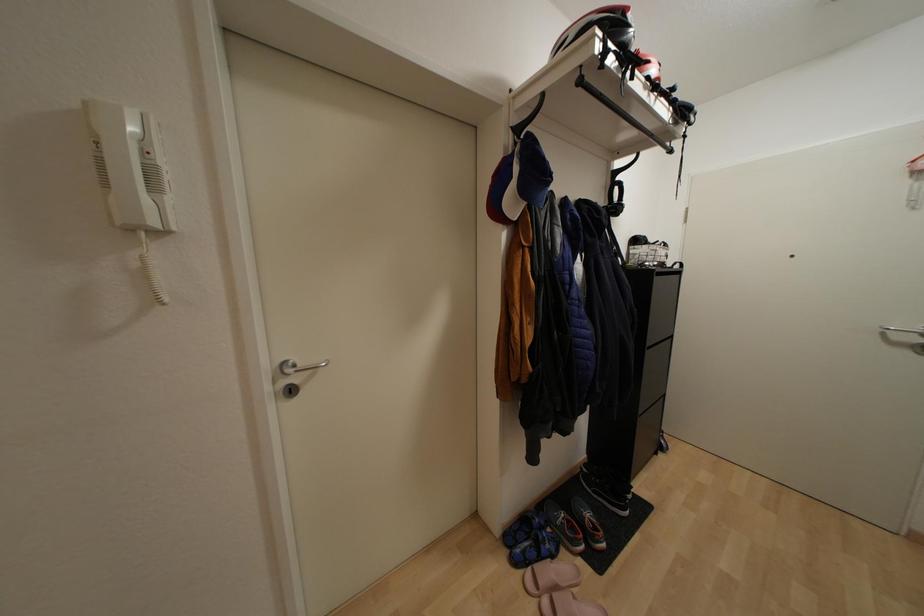
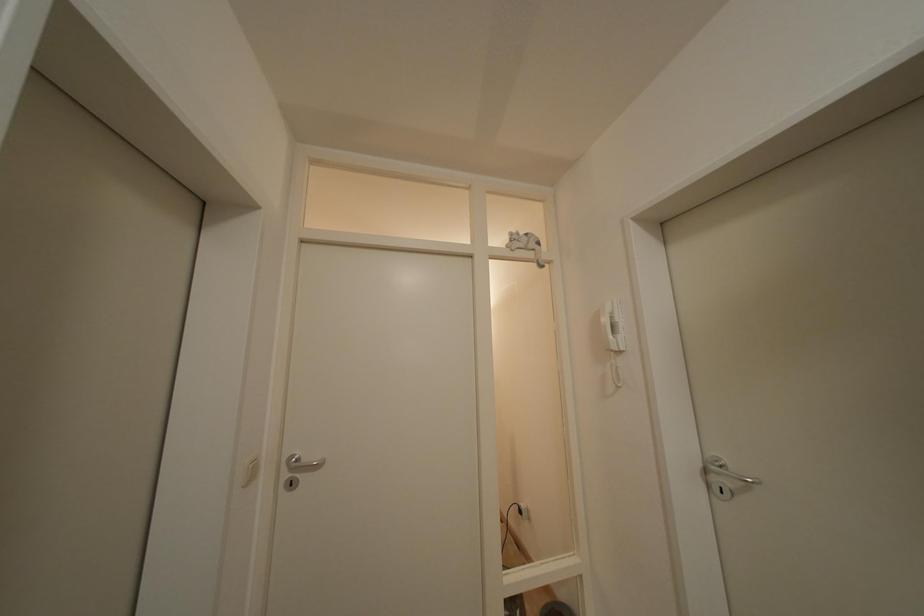
Question: The first image is from the beginning of the video and the second image is from the end. How did the camera likely rotate when shooting the video?

Choices:
 (A) Left
 (B) Right
 (C) Up
 (D) Down

Answer: (A)